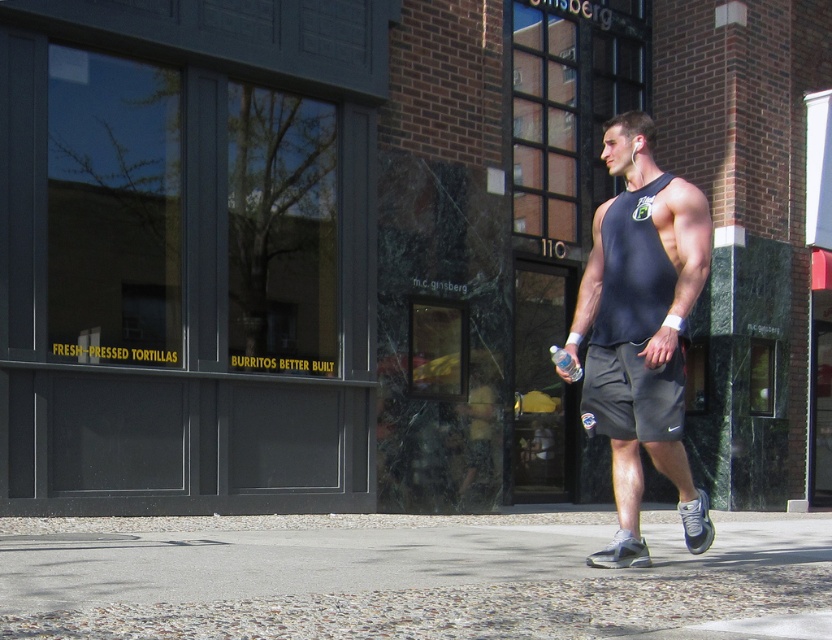
You are a drone operator trying to capture a photo of the gray cobblestone pavement at lower center. The camera is currently positioned at point A. To ensure the pavement is centered in the photo, should you move the camera north or south? Please provide your answer based on the coordinates provided in the scene description.

The gray cobblestone pavement at lower center is located at coordinates (410, 577). Since the y coordinate is 0.494, which is just below the center point of 0.5, the pavement is slightly south of the center. To center it, move the camera north slightly.

Looking at the person in the image, which clothing item is positioned to the right of the other between the matte black tank top at center and the gray fabric shorts at center?

The matte black tank top at center is to the right of the gray fabric shorts at center.

You are standing on the sidewalk and see two points marked in the image. Which point is closer to you, point (x=397, y=515) or point (x=674, y=362)?

Point (x=397, y=515) is closer to you because it is further to the viewer than point (x=674, y=362).